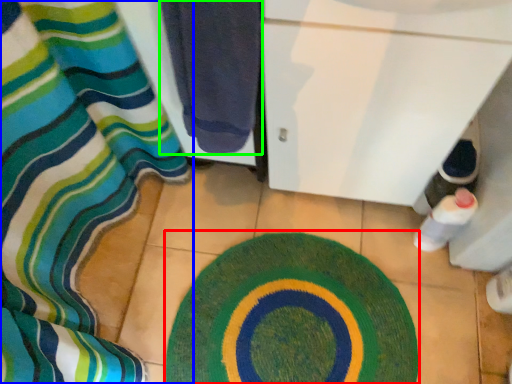
Question: Estimate the real-world distances between objects in this image. Which object is closer to bath mat (highlighted by a red box), curtain (highlighted by a blue box) or towel (highlighted by a green box)?

Choices:
 (A) curtain
 (B) towel

Answer: (A)